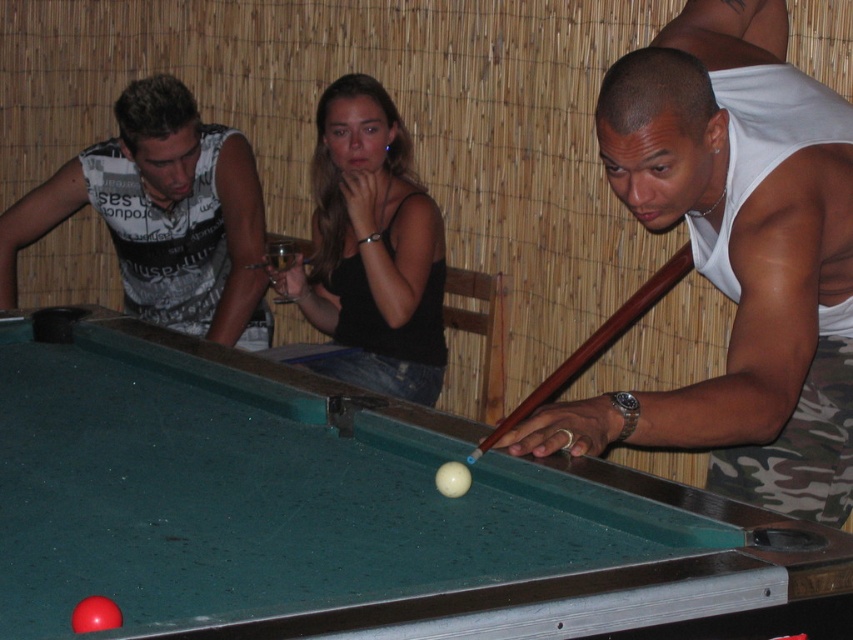
Question: Is the position of white matte tank top at center less distant than that of black matte tank top at center?

Choices:
 (A) no
 (B) yes

Answer: (B)

Question: Which of these objects is positioned farthest from the green felt billiard table at center?

Choices:
 (A) brown wood pool cue at center
 (B) white printed tank top at left
 (C) white matte tank top at center

Answer: (B)

Question: Which object is the closest to the brown wood pool cue at center?

Choices:
 (A) green felt billiard table at center
 (B) black matte tank top at center
 (C) white printed tank top at left
 (D) white matte tank top at center

Answer: (D)

Question: Based on their relative distances, which object is nearer to the black matte tank top at center?

Choices:
 (A) white printed tank top at left
 (B) green felt billiard table at center
 (C) white matte tank top at center
 (D) brown wood pool cue at center

Answer: (A)

Question: Observing the image, what is the correct spatial positioning of green felt billiard table at center in reference to black matte tank top at center?

Choices:
 (A) above
 (B) below

Answer: (B)

Question: Is white printed tank top at left above black matte tank top at center?

Choices:
 (A) yes
 (B) no

Answer: (A)